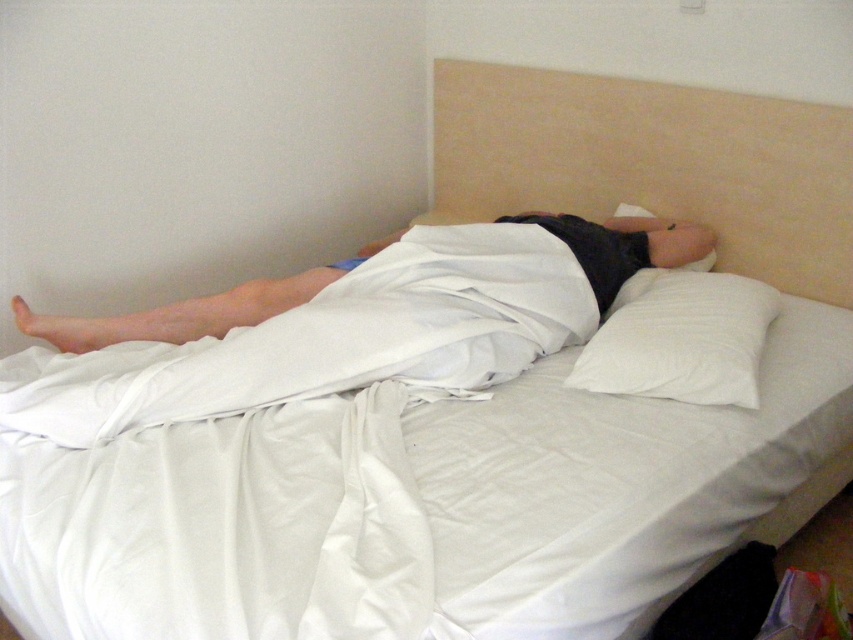
You are a person who wants to place a small decorative item on either the beige fabric headboard at upper center or the smooth white towel at lower left. Based on their sizes, which surface would you choose to ensure the item fits comfortably without hanging over the edges?

The beige fabric headboard at upper center is larger in size than the smooth white towel at lower left, so placing the small decorative item on the beige fabric headboard at upper center would ensure it fits comfortably without hanging over the edges.

You are a person who wants to place a small book on the closest object to your head while lying on the bed. Which object should you choose between the beige fabric headboard at upper center and the white soft pillow at upper right?

The white soft pillow at upper right is closer to your head than the beige fabric headboard at upper center, so you should choose the white soft pillow at upper right to place the book.

You are a delivery robot that is 1.5 meters tall. You need to place a small package on the white soft pillow at upper right. Can you reach it?

The white soft pillow at upper right is 1.81 meters away from the viewer. Since the robot is 1.5 meters tall, it cannot reach the pillow as it is taller than the robot.